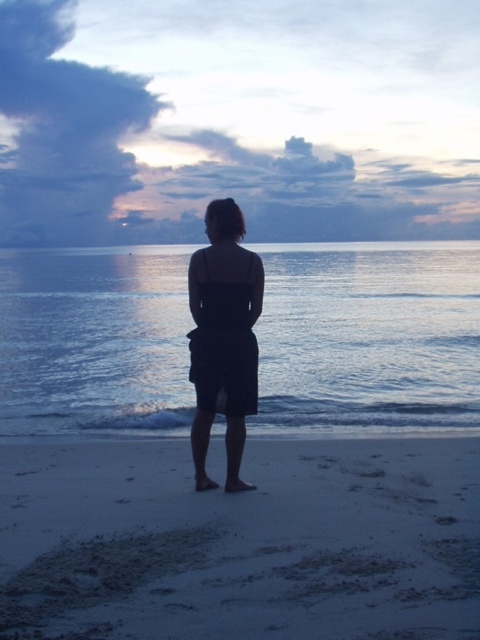
Question: Which object appears closest to the camera in this image?

Choices:
 (A) glistening blue water at center
 (B) black matte dress at center
 (C) white sandy beach at lower center

Answer: (C)

Question: Which point is farther to the camera?

Choices:
 (A) white sandy beach at lower center
 (B) black matte dress at center

Answer: (B)

Question: Is white sandy beach at lower center positioned behind glistening blue water at center?

Choices:
 (A) yes
 (B) no

Answer: (B)

Question: Considering the relative positions of glistening blue water at center and black matte dress at center in the image provided, where is glistening blue water at center located with respect to black matte dress at center?

Choices:
 (A) left
 (B) right

Answer: (A)

Question: Is white sandy beach at lower center behind glistening blue water at center?

Choices:
 (A) yes
 (B) no

Answer: (B)

Question: Which is nearer to the black matte dress at center?

Choices:
 (A) glistening blue water at center
 (B) white sandy beach at lower center

Answer: (B)